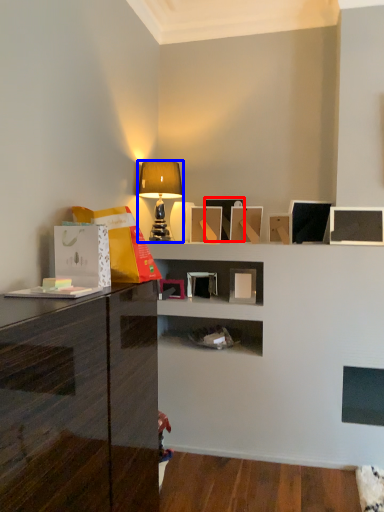
Question: Which object is further to the camera taking this photo, picture frame (highlighted by a red box) or lamp (highlighted by a blue box)?

Choices:
 (A) picture frame
 (B) lamp

Answer: (A)